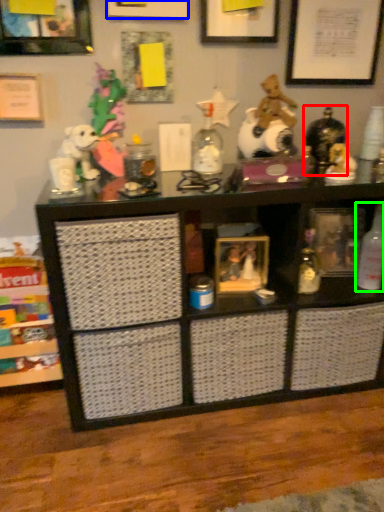
Question: Which is nearer to the toy (highlighted by a red box)? picture frame (highlighted by a blue box) or bottle (highlighted by a green box).

Choices:
 (A) picture frame
 (B) bottle

Answer: (B)